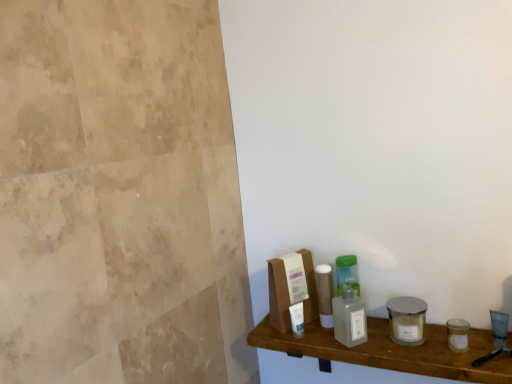
Question: Would you say transparent plastic bottle at center is part of translucent plastic bottles at center's contents?

Choices:
 (A) yes
 (B) no

Answer: (B)

Question: Does translucent plastic bottles at center appear on the right side of transparent plastic bottle at center?

Choices:
 (A) no
 (B) yes

Answer: (B)

Question: From a real-world perspective, is translucent plastic bottles at center under transparent plastic bottle at center?

Choices:
 (A) no
 (B) yes

Answer: (B)

Question: Is translucent plastic bottles at center facing away from transparent plastic bottle at center?

Choices:
 (A) yes
 (B) no

Answer: (B)

Question: Would you say translucent plastic bottles at center is outside transparent plastic bottle at center?

Choices:
 (A) no
 (B) yes

Answer: (B)

Question: Considering the relative positions of translucent plastic bottles at center and transparent plastic bottle at center in the image provided, is translucent plastic bottles at center behind transparent plastic bottle at center?

Choices:
 (A) no
 (B) yes

Answer: (A)

Question: From a real-world perspective, is transparent plastic bottle at center located beneath translucent plastic bottles at center?

Choices:
 (A) yes
 (B) no

Answer: (B)

Question: Is transparent plastic bottle at center far away from translucent plastic bottles at center?

Choices:
 (A) no
 (B) yes

Answer: (A)

Question: Is transparent plastic bottle at center oriented away from translucent plastic bottles at center?

Choices:
 (A) yes
 (B) no

Answer: (B)

Question: From a real-world perspective, is transparent plastic bottle at center located higher than translucent plastic bottles at center?

Choices:
 (A) yes
 (B) no

Answer: (A)

Question: Does transparent plastic bottle at center have a greater height compared to translucent plastic bottles at center?

Choices:
 (A) yes
 (B) no

Answer: (B)

Question: Can you confirm if transparent plastic bottle at center is smaller than translucent plastic bottles at center?

Choices:
 (A) yes
 (B) no

Answer: (A)

Question: Looking at the image, does transparent plastic bottle at center seem bigger or smaller compared to translucent plastic bottles at center?

Choices:
 (A) small
 (B) big

Answer: (A)